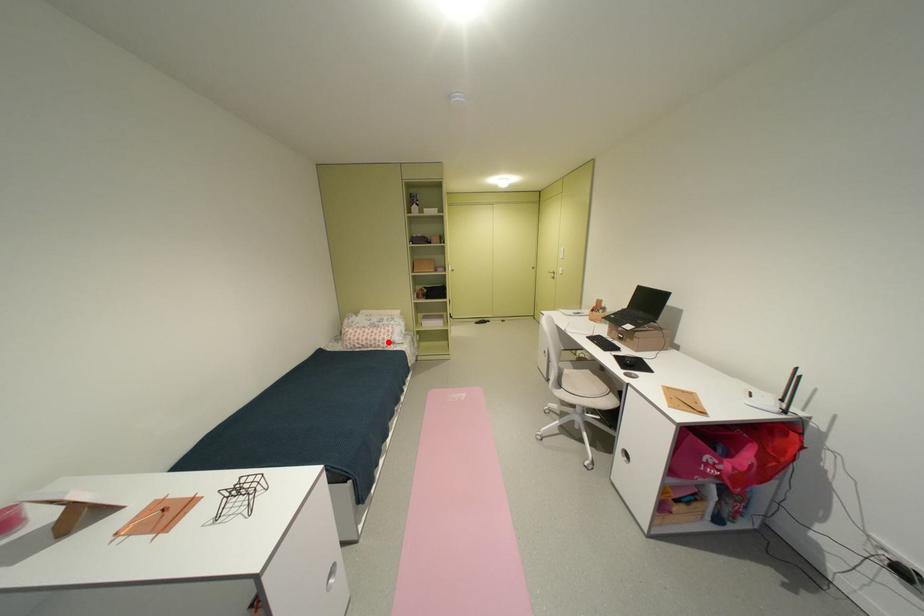
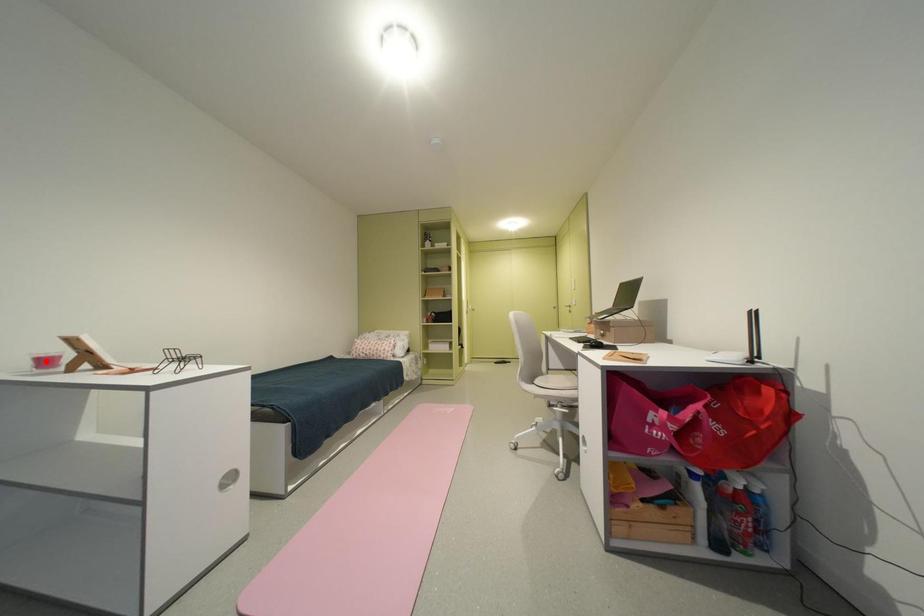
I am providing you with two images of the same scene from different viewpoints. A red point is marked on the first image and another point is marked on the second image. Do the highlighted points in image1 and image2 indicate the same real-world spot?

No